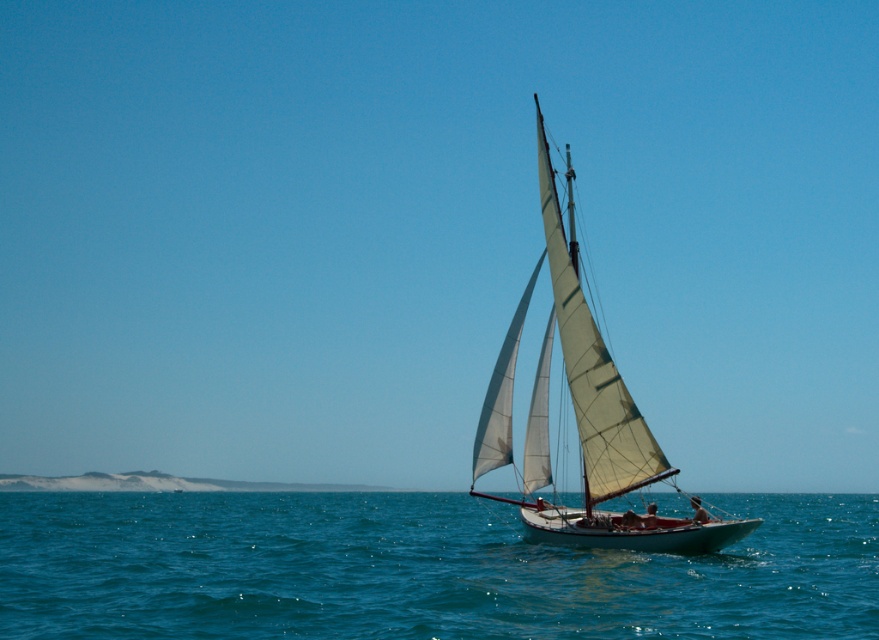
Is point (146, 627) farther from viewer compared to point (525, 481)?

No, (146, 627) is in front of (525, 481).

Can you confirm if blue water at center is smaller than white canvas sail at center?

Actually, blue water at center might be larger than white canvas sail at center.

Is point (448, 518) closer to viewer compared to point (499, 390)?

No, it is not.

Find the location of `blue water at center`. blue water at center is located at coordinates (416, 570).